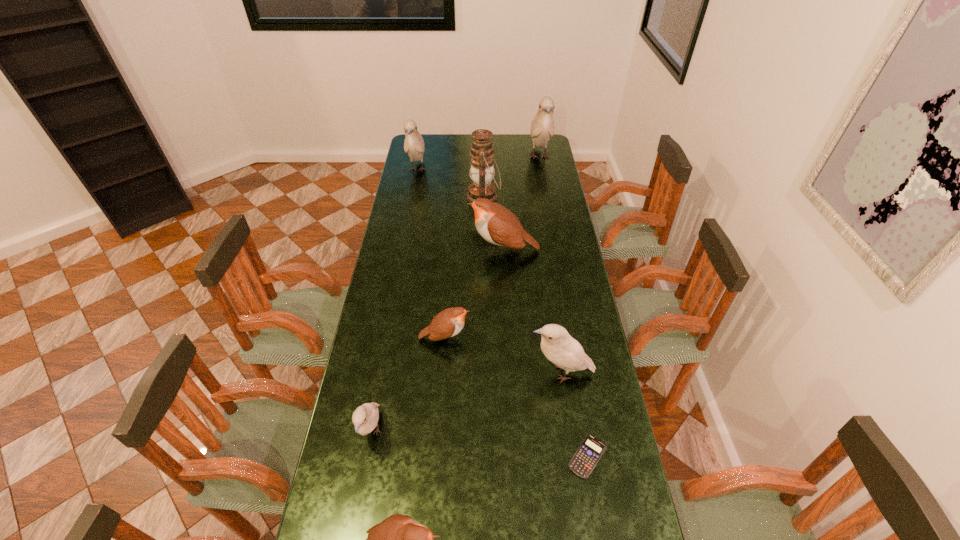
Locate an element on the screen. This screenshot has height=540, width=960. the fourth nearest bird is located at coordinates (449, 322).

Where is `calculator`? The width and height of the screenshot is (960, 540). calculator is located at coordinates (585, 459).

Where is `the shortest object`? the shortest object is located at coordinates (585, 459).

The width and height of the screenshot is (960, 540). I want to click on free spot located at the beak of the tallest bird, so click(x=544, y=187).

At what (x,y) coordinates should I click in order to perform the action: click on free space located 0.270m on the left of the lantern. Please return your answer as a coordinate pair (x, y). Looking at the image, I should click on (411, 197).

Find the location of a particular element. blank area located 0.230m at the beak of the second biggest white bird is located at coordinates (409, 212).

Where is `vacant position located at the face of the sixth nearest object`? The height and width of the screenshot is (540, 960). vacant position located at the face of the sixth nearest object is located at coordinates (x=408, y=250).

The height and width of the screenshot is (540, 960). What are the coordinates of `vacant space located 0.050m at the face of the sixth nearest object` in the screenshot? It's located at click(456, 250).

The width and height of the screenshot is (960, 540). Find the location of `vacant space located 0.120m at the face of the sixth nearest object`. vacant space located 0.120m at the face of the sixth nearest object is located at coordinates (439, 250).

This screenshot has height=540, width=960. What are the coordinates of `free space located 0.390m at the beak of the third nearest bird` in the screenshot? It's located at (407, 373).